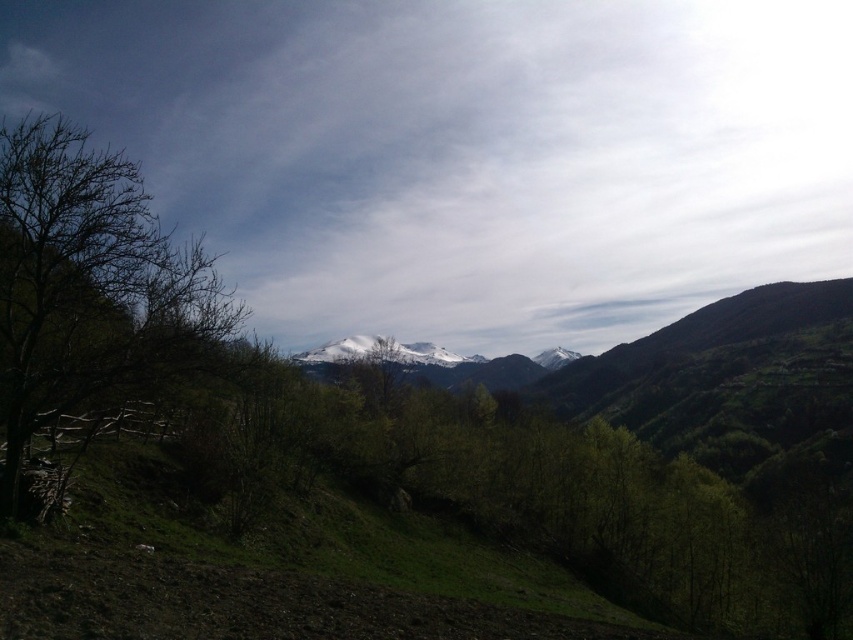
Does point (171, 314) come farther from viewer compared to point (482, 372)?

That is False.

Which is behind, point (184, 321) or point (334, 355)?

The point (334, 355) is behind.

What do you see at coordinates (90, 285) in the screenshot? Image resolution: width=853 pixels, height=640 pixels. I see `bare branches at left` at bounding box center [90, 285].

Identify the location of bare branches at left. (90, 285).

Can you confirm if white fluffy cloud at upper center is shorter than white snow-covered mountain range at center?

No, white fluffy cloud at upper center is not shorter than white snow-covered mountain range at center.

Can you confirm if white fluffy cloud at upper center is smaller than white snow-covered mountain range at center?

No, white fluffy cloud at upper center is not smaller than white snow-covered mountain range at center.

This screenshot has width=853, height=640. I want to click on white fluffy cloud at upper center, so click(x=468, y=152).

Measure the distance between white fluffy cloud at upper center and camera.

white fluffy cloud at upper center and camera are 21.60 meters apart from each other.

Does white fluffy cloud at upper center have a greater height compared to bare branches at left?

Yes, white fluffy cloud at upper center is taller than bare branches at left.

Identify the location of white fluffy cloud at upper center. (468, 152).